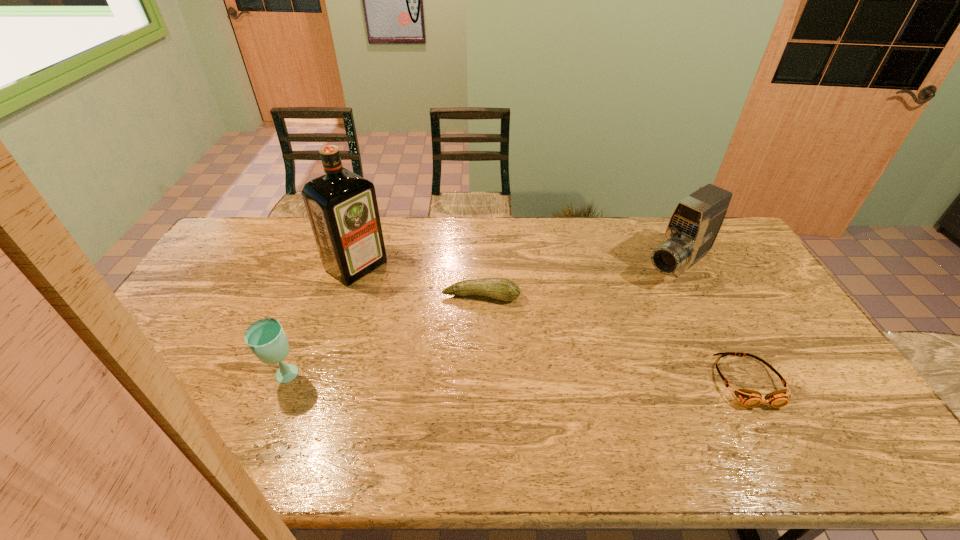
I want to click on vacant space on the desktop that is between the glass and the shortest object and is positioned at the front of the fourth shortest object, highlighting the lens, so 535,379.

Image resolution: width=960 pixels, height=540 pixels. I want to click on vacant spot on the desktop that is between the third tallest object and the shortest object and is positioned at the stem end of the zucchini, so click(x=466, y=378).

Find the location of `free space on the desktop that is between the glass and the goggles and is positioned on the front label of the tallest object`. free space on the desktop that is between the glass and the goggles and is positioned on the front label of the tallest object is located at coordinates (524, 379).